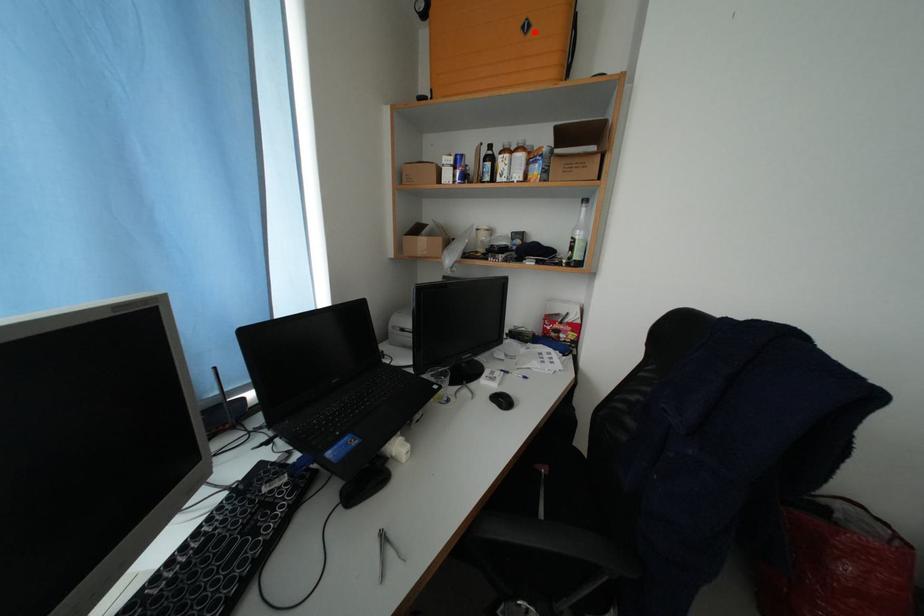
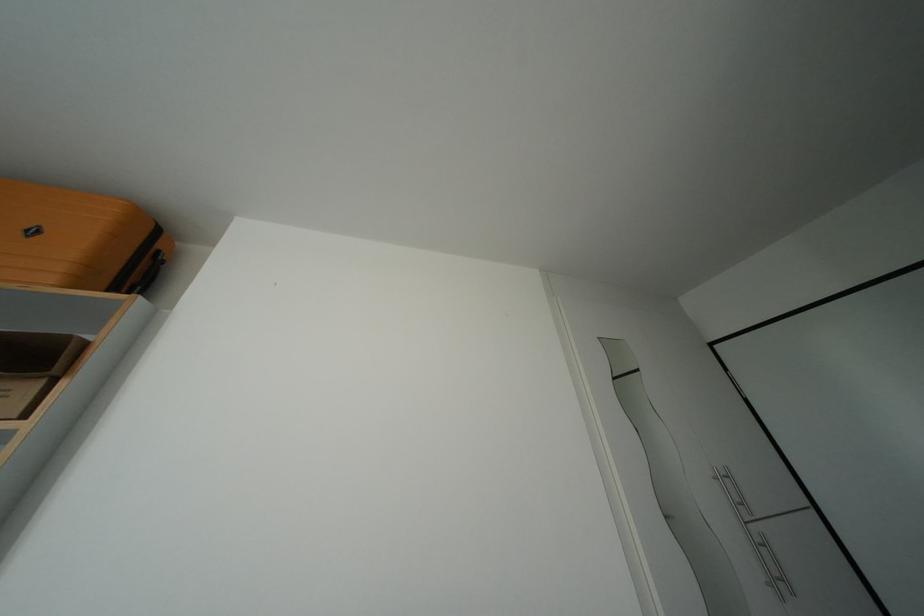
Question: I am providing you with two images of the same scene from different viewpoints. A red point is marked on the first image. At the location where the point appears in image 1, is it still visible in image 2?

Choices:
 (A) Yes
 (B) No

Answer: (A)